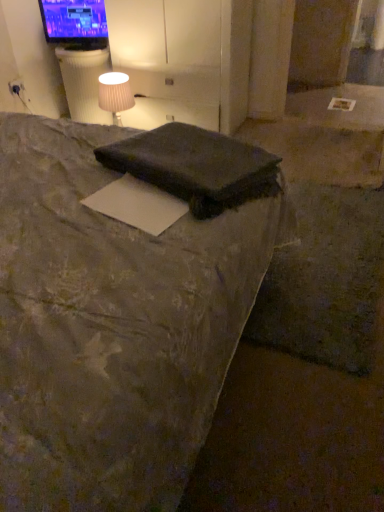
Question: Is white matte paper at center oriented towards matte white fabric at upper left?

Choices:
 (A) yes
 (B) no

Answer: (B)

Question: Is white matte paper at center smaller than matte white fabric at upper left?

Choices:
 (A) no
 (B) yes

Answer: (B)

Question: Considering the relative sizes of white matte paper at center and matte white fabric at upper left in the image provided, is white matte paper at center wider than matte white fabric at upper left?

Choices:
 (A) no
 (B) yes

Answer: (A)

Question: Is white matte paper at center far from matte white fabric at upper left?

Choices:
 (A) yes
 (B) no

Answer: (A)

Question: Can you confirm if white matte paper at center is shorter than matte white fabric at upper left?

Choices:
 (A) yes
 (B) no

Answer: (A)

Question: Is point (218, 214) closer or farther from the camera than point (109, 193)?

Choices:
 (A) farther
 (B) closer

Answer: (B)

Question: Considering their positions, is dark gray fabric pillow at center located in front of or behind white matte paper at center?

Choices:
 (A) front
 (B) behind

Answer: (B)

Question: Would you say dark gray fabric pillow at center is to the left or to the right of white matte paper at center in the picture?

Choices:
 (A) right
 (B) left

Answer: (A)

Question: Is dark gray fabric pillow at center spatially inside white matte paper at center, or outside of it?

Choices:
 (A) inside
 (B) outside

Answer: (B)

Question: Relative to matte black tv at upper left, is matte white fabric at upper left in front or behind?

Choices:
 (A) front
 (B) behind

Answer: (A)

Question: From a real-world perspective, is matte white fabric at upper left positioned above or below matte black tv at upper left?

Choices:
 (A) below
 (B) above

Answer: (A)

Question: Considering the positions of matte white fabric at upper left and matte black tv at upper left in the image, is matte white fabric at upper left bigger or smaller than matte black tv at upper left?

Choices:
 (A) big
 (B) small

Answer: (A)

Question: Considering the positions of point (107, 86) and point (92, 6), is point (107, 86) closer or farther from the camera than point (92, 6)?

Choices:
 (A) farther
 (B) closer

Answer: (B)

Question: Considering the positions of dark gray fabric pillow at center and matte white outlet at upper left in the image, is dark gray fabric pillow at center wider or thinner than matte white outlet at upper left?

Choices:
 (A) thin
 (B) wide

Answer: (B)

Question: Considering their positions, is dark gray fabric pillow at center located in front of or behind matte white outlet at upper left?

Choices:
 (A) behind
 (B) front

Answer: (B)